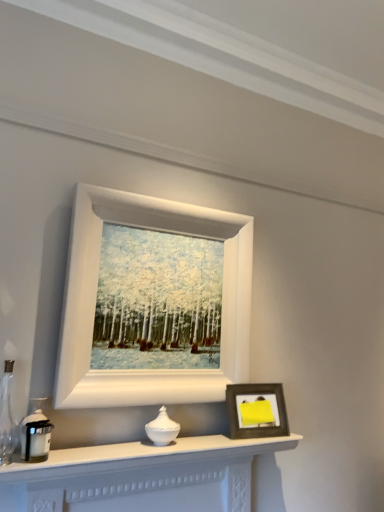
I want to click on vacant space to the left of wooden photo frame at lower right, which is counted as the second picture frame, starting from the top, so click(x=220, y=435).